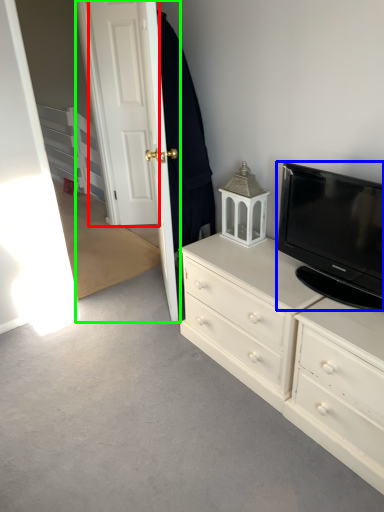
Question: Estimate the real-world distances between objects in this image. Which object is closer to door (highlighted by a red box), television (highlighted by a blue box) or door (highlighted by a green box)?

Choices:
 (A) television
 (B) door

Answer: (B)